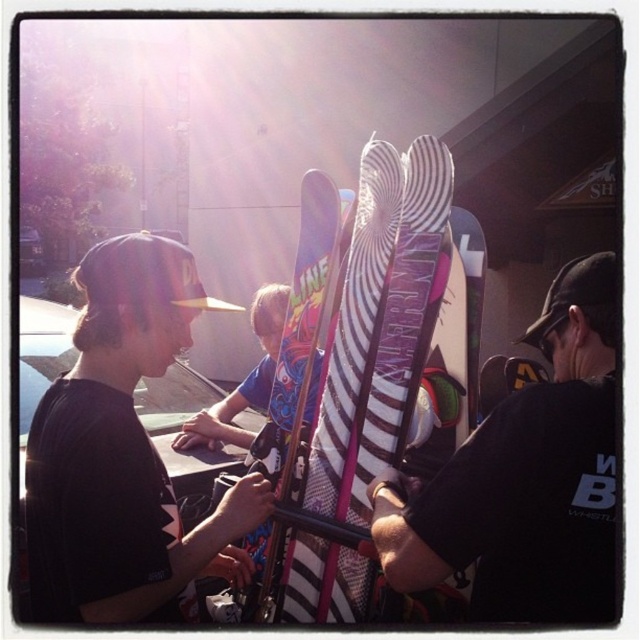
Question: Observing the image, what is the correct spatial positioning of black matte cap at left in reference to multicolored striped ski at center?

Choices:
 (A) above
 (B) below

Answer: (B)

Question: Observing the image, what is the correct spatial positioning of black matte cap at left in reference to multicolored striped ski at center?

Choices:
 (A) above
 (B) below

Answer: (B)

Question: Estimate the real-world distances between objects in this image. Which object is closer to the matte black t-shirt at center?

Choices:
 (A) multicolored striped ski at center
 (B) black matte cap at left

Answer: (A)

Question: Which point is closer to the camera?

Choices:
 (A) (200, 547)
 (B) (364, 259)
 (C) (563, 540)

Answer: (C)

Question: Does matte black t-shirt at center appear over multicolored striped ski at center?

Choices:
 (A) no
 (B) yes

Answer: (A)

Question: Which object is closer to the camera taking this photo?

Choices:
 (A) multicolored striped ski at center
 (B) matte black t-shirt at center
 (C) black matte cap at left

Answer: (B)